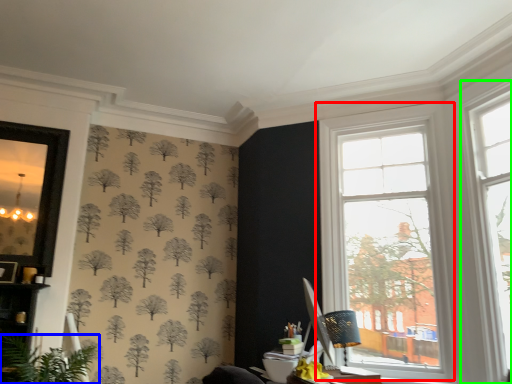
Question: Which is farther away from window (highlighted by a red box)? houseplant (highlighted by a blue box) or window (highlighted by a green box)?

Choices:
 (A) houseplant
 (B) window

Answer: (A)